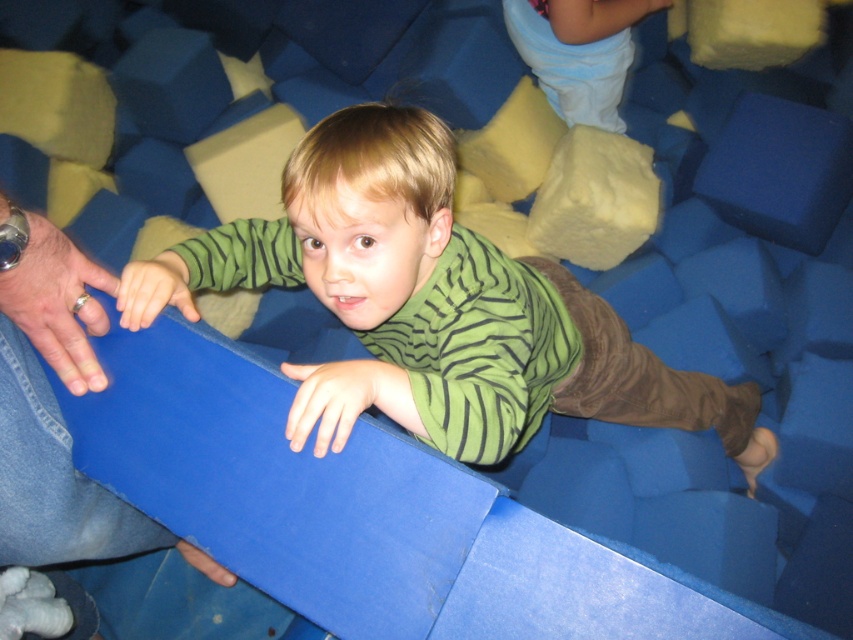
Identify the location of green striped shirt at center. Image resolution: width=853 pixels, height=640 pixels. tap(434, 307).

Is green striped shirt at center wider than light blue fabric pants at upper center?

Indeed, green striped shirt at center has a greater width compared to light blue fabric pants at upper center.

Does point (664, 384) come in front of point (556, 33)?

Yes, it is.

In order to click on green striped shirt at center in this screenshot , I will do `click(434, 307)`.